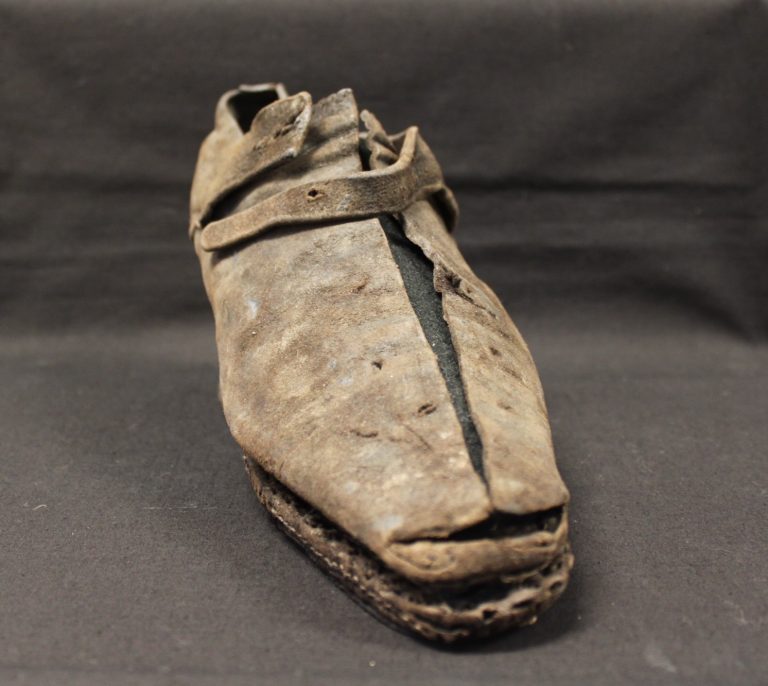
Identify the location of crease in fabric. (604, 187), (574, 245), (571, 283).